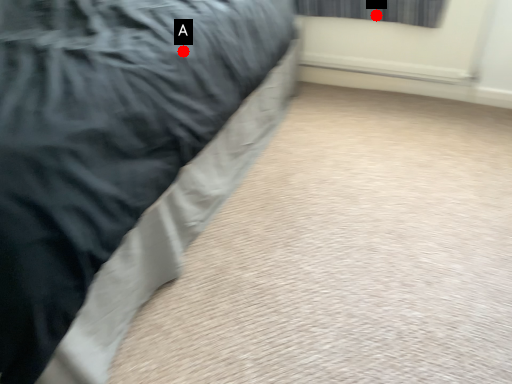
Question: Two points are circled on the image, labeled by A and B beside each circle. Which point is farther to the camera?

Choices:
 (A) A is further
 (B) B is further

Answer: (B)